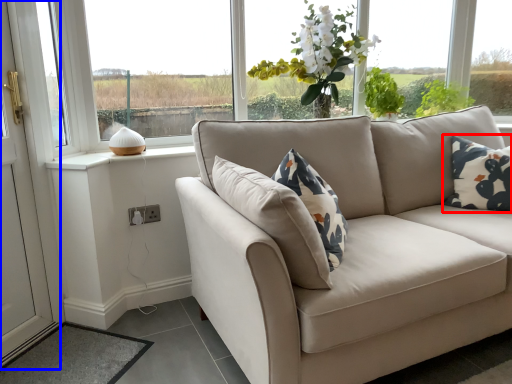
Question: Which object is closer to the camera taking this photo, pillow (highlighted by a red box) or screen door (highlighted by a blue box)?

Choices:
 (A) pillow
 (B) screen door

Answer: (B)